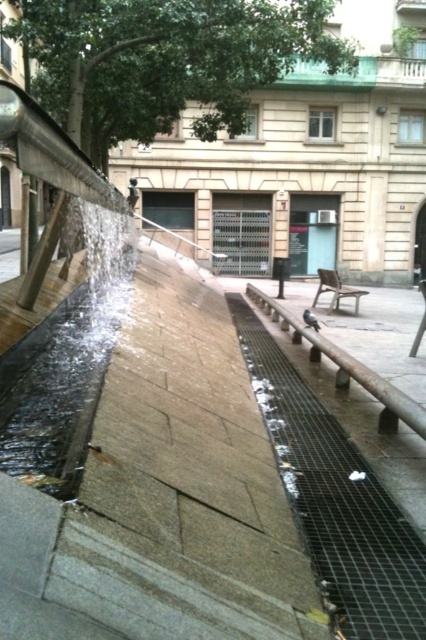
Question: Does clear glass water at left appear on the right side of wooden park bench at center?

Choices:
 (A) yes
 (B) no

Answer: (B)

Question: Which of the following is the farthest from the observer?

Choices:
 (A) clear glass water at left
 (B) wooden park bench at center
 (C) brown wooden rail at center

Answer: (B)

Question: From the image, what is the correct spatial relationship of brown wooden rail at center in relation to wooden park bench at center?

Choices:
 (A) below
 (B) above

Answer: (A)

Question: Among these objects, which one is nearest to the camera?

Choices:
 (A) brown wooden rail at center
 (B) clear glass water at left

Answer: (B)

Question: Is clear glass water at left bigger than wooden park bench at center?

Choices:
 (A) yes
 (B) no

Answer: (A)

Question: Which object is closer to the camera taking this photo?

Choices:
 (A) brown wooden rail at center
 (B) clear glass water at left
 (C) wooden park bench at center

Answer: (B)